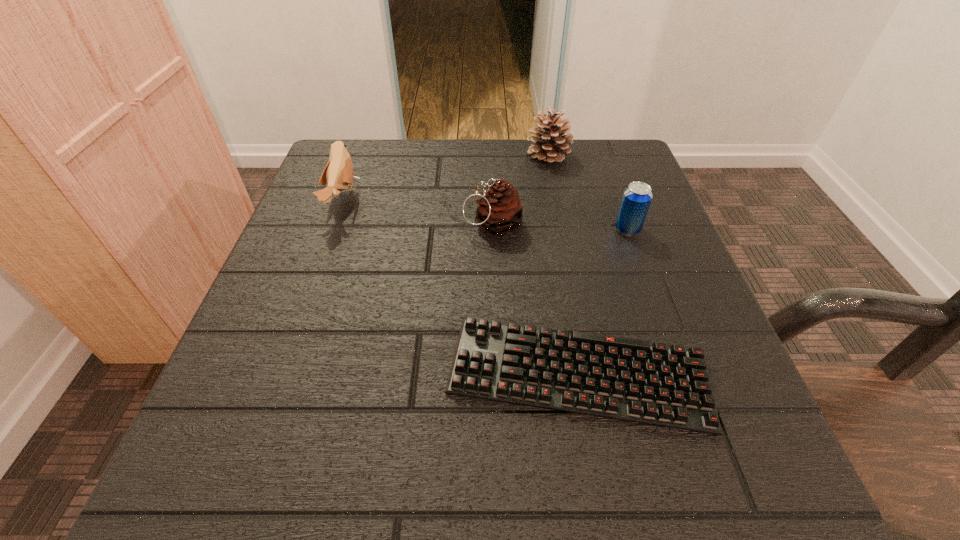
The width and height of the screenshot is (960, 540). Identify the location of computer keyboard positioned at the right edge. (627, 379).

Find the location of a particular element. object that is at the far left corner is located at coordinates (338, 174).

Locate an element on the screen. object present at the far right corner is located at coordinates (550, 146).

Find the location of `object that is at the near right corner`. object that is at the near right corner is located at coordinates (627, 379).

The height and width of the screenshot is (540, 960). In order to click on vacant region at the far edge of the desktop in this screenshot , I will do pyautogui.click(x=506, y=163).

The width and height of the screenshot is (960, 540). Identify the location of vacant space at the near edge. (549, 440).

Locate an element on the screen. The image size is (960, 540). vacant space at the left edge of the desktop is located at coordinates (334, 273).

You are a GUI agent. You are given a task and a screenshot of the screen. Output one action in this format:
    pyautogui.click(x=<x>, y=<y>)
    Task: Click on the free space at the right edge of the desktop
    
    Given the screenshot: What is the action you would take?
    pyautogui.click(x=628, y=285)

The height and width of the screenshot is (540, 960). I want to click on vacant area at the far left corner of the desktop, so click(366, 197).

Image resolution: width=960 pixels, height=540 pixels. Find the location of `free space at the far right corner`. free space at the far right corner is located at coordinates (572, 152).